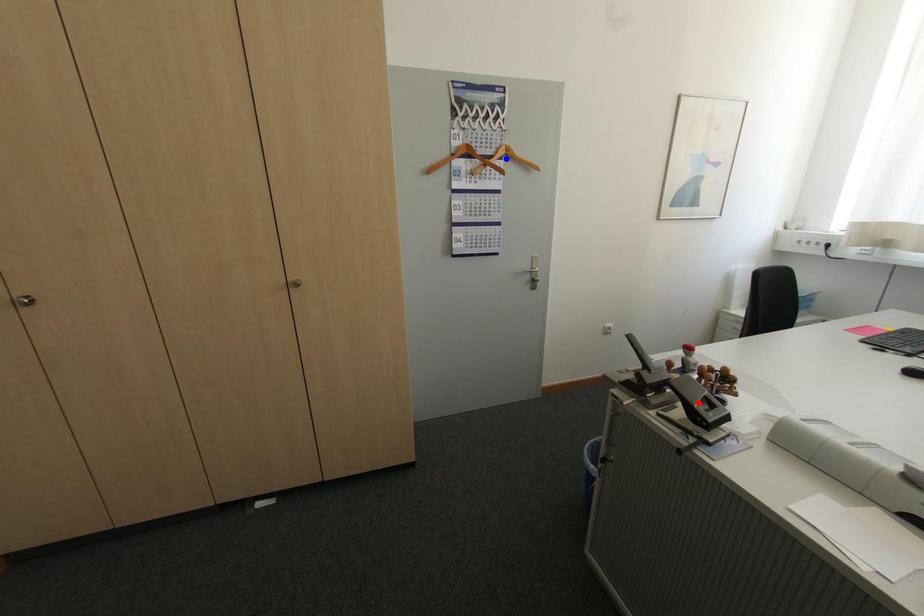
Question: Which of the two points in the image is closer to the camera?

Choices:
 (A) Blue point is closer.
 (B) Red point is closer.

Answer: (B)